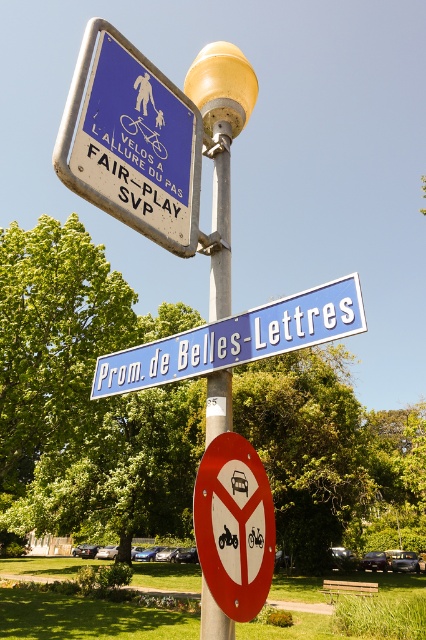
You are standing at the point labeled point (x=204, y=132) and want to walk towards the signpost. Which direction should you move to reach the signpost first, towards point (x=221, y=596) or away from it?

You should move towards point (x=221, y=596) because it is in front of point (x=204, y=132), meaning it is closer to the signpost.

You are a delivery person trying to attach a sticker to the wider object between the blue plastic street sign at center and the yellow plastic lamp post at center. Which object should you choose?

The yellow plastic lamp post at center is wider than the blue plastic street sign at center, so you should choose the yellow plastic lamp post at center to attach the sticker.

You are standing in front of the street signpost and see the point at coordinates point (235,525). Which object from the scene does this point belong to?

The point (235,525) is on the red plastic sign at lower center.